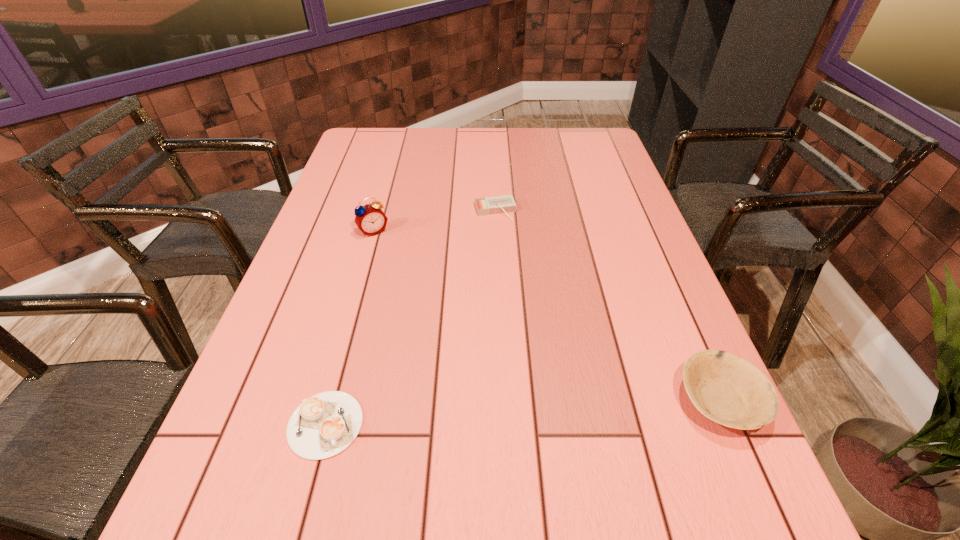
Locate an element on the screen. object positioned at the near left corner is located at coordinates (325, 424).

At what (x,y) coordinates should I click in order to perform the action: click on object that is at the near right corner. Please return your answer as a coordinate pair (x, y). This screenshot has height=540, width=960. Looking at the image, I should click on (726, 388).

The image size is (960, 540). In the image, there is a desktop. In order to click on vacant space at the far edge in this screenshot , I will do `click(442, 129)`.

The height and width of the screenshot is (540, 960). In the image, there is a desktop. In order to click on vacant space at the left edge in this screenshot , I will do `click(331, 212)`.

Identify the location of vacant space at the right edge of the desktop. (589, 198).

Image resolution: width=960 pixels, height=540 pixels. In the image, there is a desktop. In order to click on vacant space at the far left corner in this screenshot , I will do `click(362, 153)`.

The width and height of the screenshot is (960, 540). In the image, there is a desktop. Identify the location of vacant space at the near left corner. [268, 440].

This screenshot has height=540, width=960. Find the location of `vacant space that is in between the second shortest object and the third nearest object`. vacant space that is in between the second shortest object and the third nearest object is located at coordinates (435, 221).

Find the location of a particular element. free area in between the tallest object and the second object from right to left is located at coordinates (435, 221).

Find the location of `vacant space in between the tallest object and the shortest object`. vacant space in between the tallest object and the shortest object is located at coordinates (349, 328).